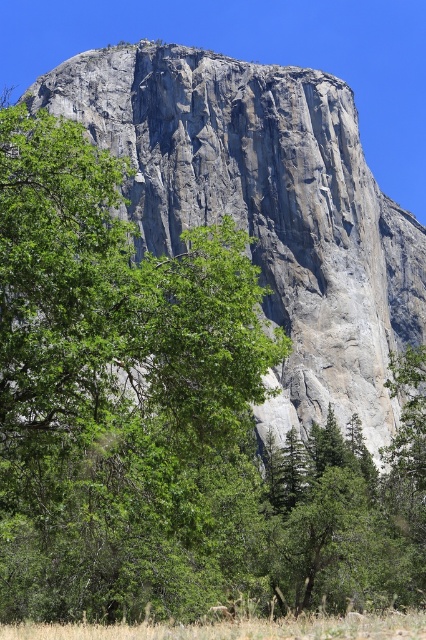
You are a hiker planning to take a photo of the gray rock mountain at center and the brown fur at lower center. Which object should you focus on first if you want to capture both in a single frame without moving the camera?

You should focus on the gray rock mountain at center first because its width is larger than the brown fur at lower center, making it the dominant subject in the frame.

You are standing in front of the granite rock formation at Yosemite National Park and want to take a photo of the point at coordinates point [262,208]. If your camera has a maximum focus range of 100 meters, will you be able to focus on that point?

The distance of point [262,208] from camera is 111.63 meters, which exceeds the camera maximum focus range of 100 meters. Therefore, the camera cannot focus on that point.

You are a hiker who has just spotted a wild animal in the distance. You see dry grass at lower center and brown fur at lower center. Which object is closer to you?

The dry grass at lower center is 20.74 feet away from brown fur at lower center, so the brown fur at lower center is closer to you since it is only 20.74 feet away from the dry grass at lower center which is further away.